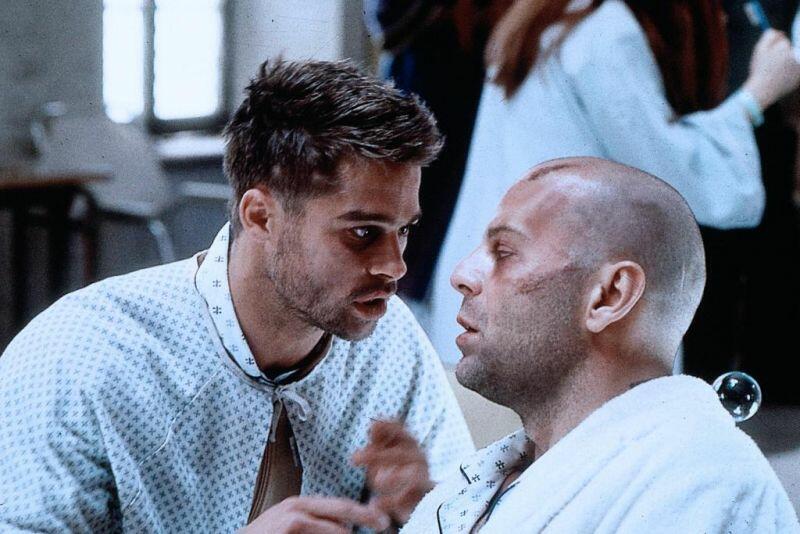
The height and width of the screenshot is (534, 800). In order to click on window in this screenshot , I will do `click(186, 45)`, `click(122, 43)`.